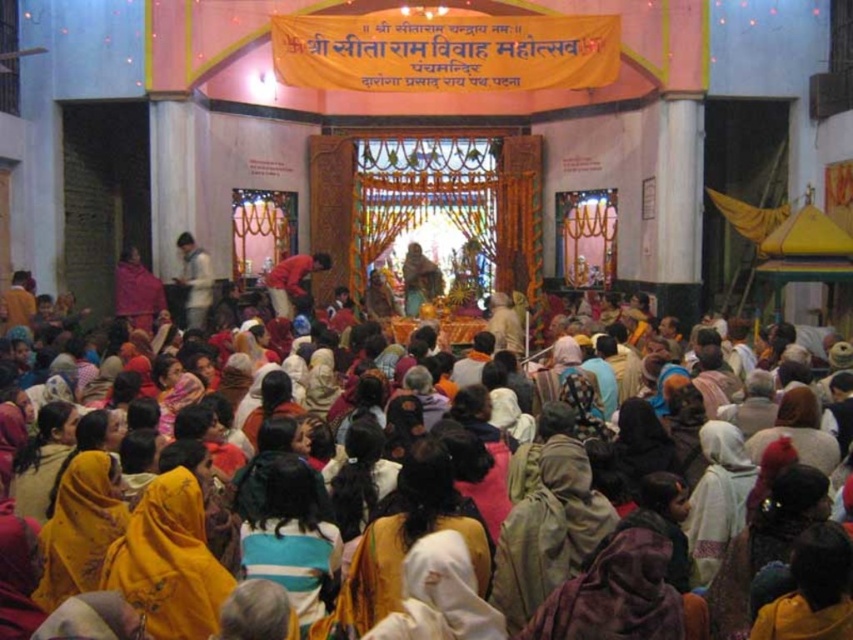
Question: Among these points, which one is nearest to the camera?

Choices:
 (A) (315, 262)
 (B) (482, 336)
 (C) (212, 285)

Answer: (B)

Question: Considering the real-world distances, which object is closest to the red fabric cloth at center?

Choices:
 (A) white matte shirt at center
 (B) yellow fabric at center

Answer: (A)

Question: Where is yellow fabric at center located in relation to white matte shirt at center in the image?

Choices:
 (A) above
 (B) below

Answer: (B)

Question: Is yellow fabric at center positioned at the back of white matte shirt at center?

Choices:
 (A) no
 (B) yes

Answer: (A)

Question: Can you confirm if yellow fabric at center is positioned to the right of red fabric cloth at center?

Choices:
 (A) yes
 (B) no

Answer: (A)

Question: Which object appears closest to the camera in this image?

Choices:
 (A) white matte shirt at center
 (B) red fabric cloth at center
 (C) yellow fabric at center

Answer: (C)